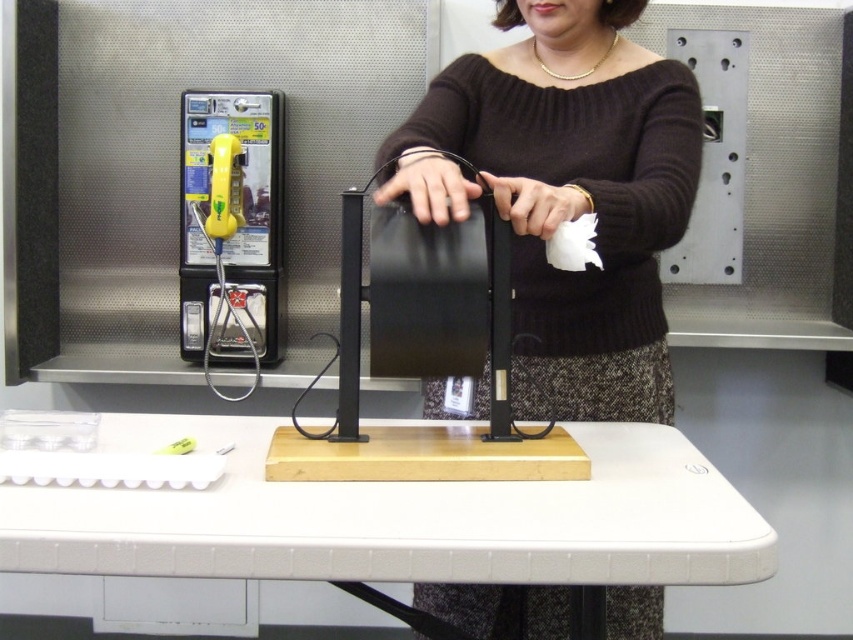
Looking at this image, what are the coordinates of the knitted dark brown sweater at center?

The coordinates of the knitted dark brown sweater at center are at point (567, 195).

Based on the photo, you are trying to determine if the knitted dark brown sweater at center can completely cover the yellow plastic phone at left when placed over it. Based on the spatial relationship between these two items, is this possible?

The knitted dark brown sweater at center might be wider than yellow plastic phone at left, so it is possible that the sweater could cover the phone if positioned correctly.